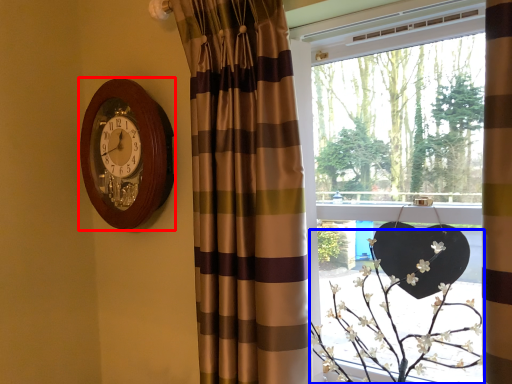
Question: Which object appears farthest to the camera in this image, wall clock (highlighted by a red box) or floral arrangement (highlighted by a blue box)?

Choices:
 (A) wall clock
 (B) floral arrangement

Answer: (A)